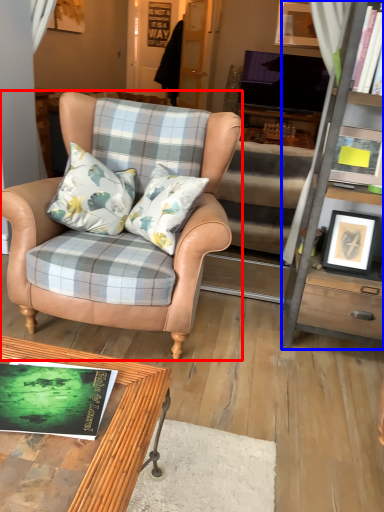
Question: Which of the following is the farthest to the observer, chair (highlighted by a red box) or cabinetry (highlighted by a blue box)?

Choices:
 (A) chair
 (B) cabinetry

Answer: (B)